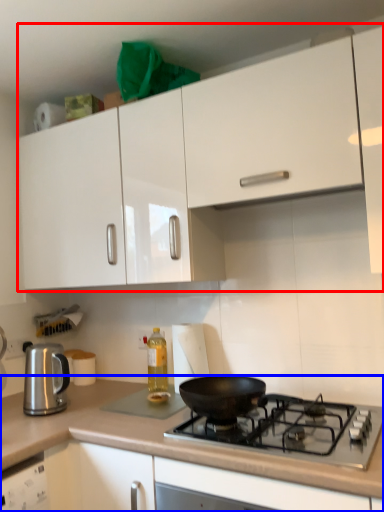
Question: Which object is further to the camera taking this photo, cabinetry (highlighted by a red box) or countertop (highlighted by a blue box)?

Choices:
 (A) cabinetry
 (B) countertop

Answer: (A)